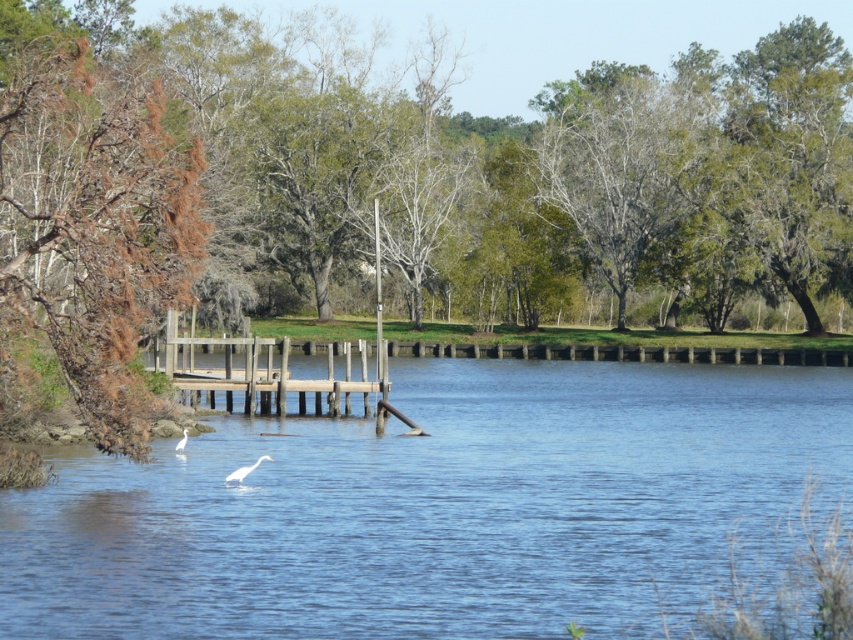
Question: In this image, where is brown/dried wood tree at left located relative to white matte bird at center?

Choices:
 (A) below
 (B) above

Answer: (B)

Question: Which object is the closest to the white matte bird at center?

Choices:
 (A) brown/dried wood tree at left
 (B) blue water at center

Answer: (B)

Question: Based on their relative distances, which object is nearer to the white smooth bird at lower center?

Choices:
 (A) brown/dried wood tree at left
 (B) blue water at center
 (C) weathered wood dock at left

Answer: (B)

Question: Which point appears closest to the camera in this image?

Choices:
 (A) (183, 436)
 (B) (224, 540)

Answer: (B)

Question: Does weathered wood dock at left have a lesser width compared to white matte bird at center?

Choices:
 (A) no
 (B) yes

Answer: (A)

Question: Can you confirm if blue water at center is wider than brown/dried wood tree at left?

Choices:
 (A) yes
 (B) no

Answer: (A)